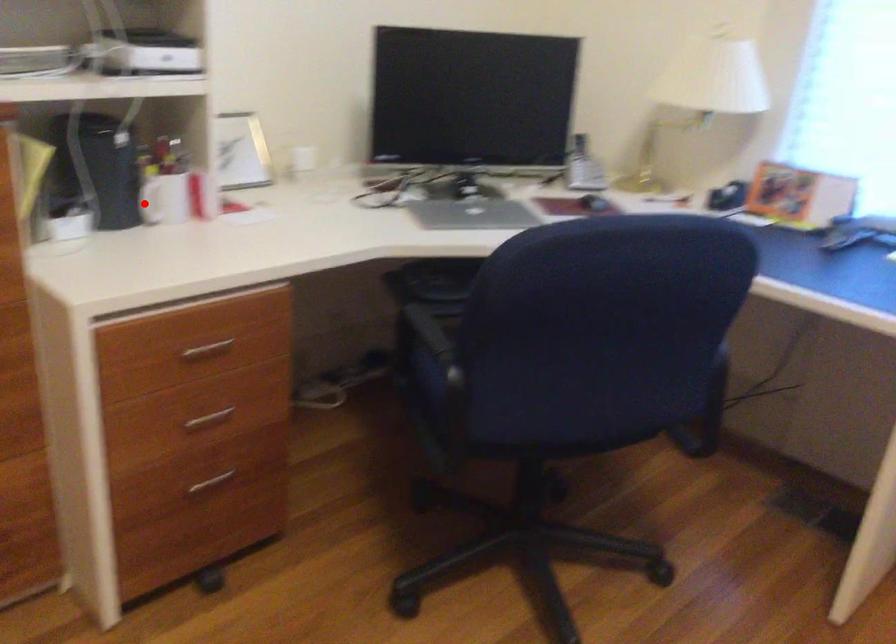
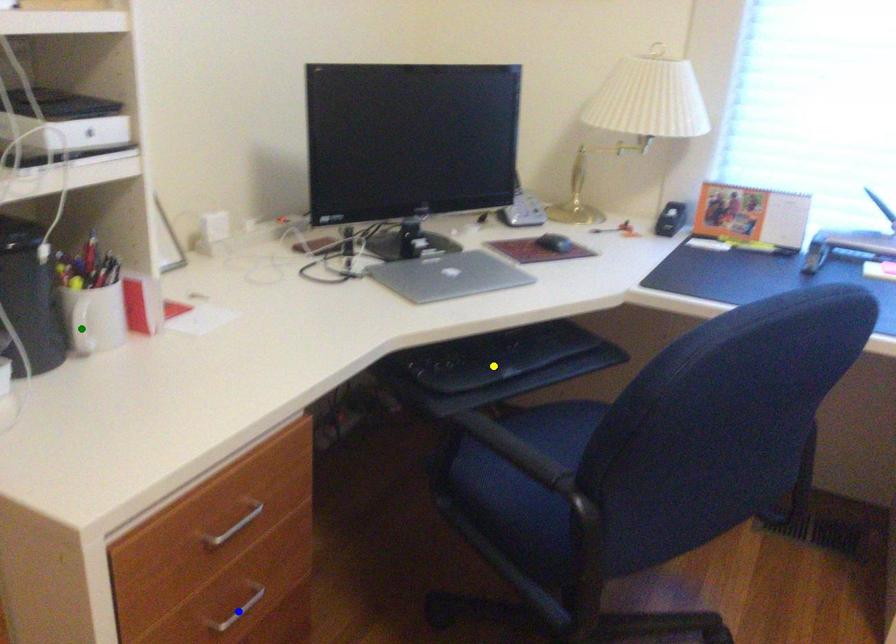
Question: I am providing you with two images of the same scene from different viewpoints. A red point is marked on the first image. You are given multiple points on the second image. Which point in image 2 is actually the same real-world point as the red point in image 1?

Choices:
 (A) green point
 (B) yellow point
 (C) blue point

Answer: (A)